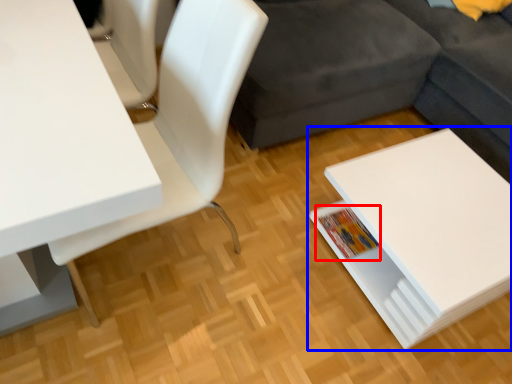
Question: Among these objects, which one is farthest to the camera, book (highlighted by a red box) or table (highlighted by a blue box)?

Choices:
 (A) book
 (B) table

Answer: (A)